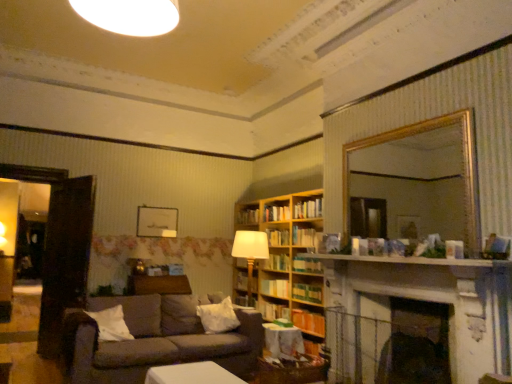
Question: Considering the positions of white glossy light fixture at upper center and hardcover book at center, arranged as the 3th book when viewed from the top, in the image, is white glossy light fixture at upper center taller or shorter than hardcover book at center, arranged as the 3th book when viewed from the top,?

Choices:
 (A) short
 (B) tall

Answer: (B)

Question: Considering their positions, is white glossy light fixture at upper center located in front of or behind hardcover book at center, arranged as the 3th book when viewed from the top?

Choices:
 (A) front
 (B) behind

Answer: (A)

Question: Which of these objects is positioned farthest from the wooden textured table at center?

Choices:
 (A) hardcover book at center, which is counted as the 11th book, starting from the bottom
 (B) white wooden mantle at upper center
 (C) white soft pillow at center, positioned as the first pillow in back-to-front order
 (D) hardcover book at center, marked as the fourth book in a bottom-to-top arrangement
 (E) wooden bookcase at center

Answer: (A)

Question: Based on their relative distances, which object is farther from the wooden textured table at center?

Choices:
 (A) white glossy light fixture at upper center
 (B) hardcover book at center, the eighth book positioned from the bottom
 (C) hardcover book at center, the 11th book in the top-to-bottom sequence
 (D) hardcover book at center, the sixth book viewed from the top
 (E) textured gray couch at lower left

Answer: (A)